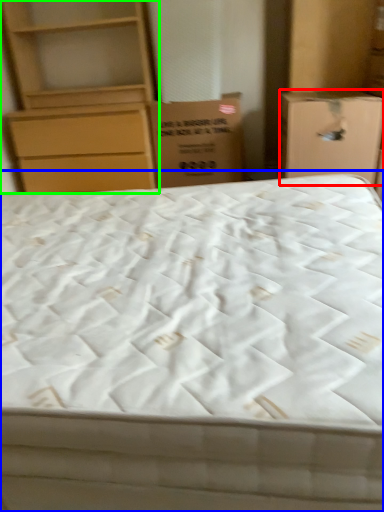
Question: Which object is positioned farthest from cardboard box (highlighted by a red box)? Select from bed (highlighted by a blue box) and chest of drawers (highlighted by a green box).

Choices:
 (A) bed
 (B) chest of drawers

Answer: (B)